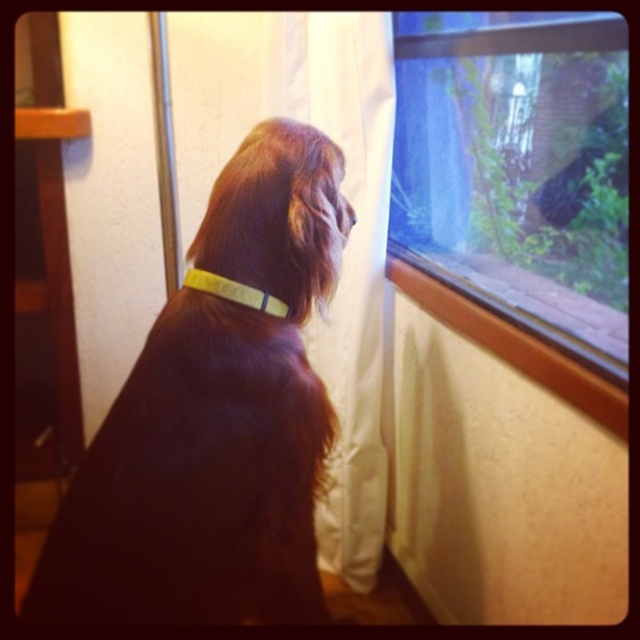
Question: Estimate the real-world distances between objects in this image. Which object is closer to the brown fur dog at center?

Choices:
 (A) transparent glass window at upper right
 (B) brown fur nose at upper center
 (C) yellow fabric neckband at center
 (D) white fabric curtain at center

Answer: (C)

Question: Does brown fur dog at center have a smaller size compared to brown fur nose at upper center?

Choices:
 (A) yes
 (B) no

Answer: (B)

Question: Is brown fur dog at center to the right of transparent glass window at upper right from the viewer's perspective?

Choices:
 (A) yes
 (B) no

Answer: (B)

Question: Does transparent glass window at upper right have a greater width compared to yellow fabric neckband at center?

Choices:
 (A) no
 (B) yes

Answer: (B)

Question: Based on their relative distances, which object is farther from the transparent glass window at upper right?

Choices:
 (A) brown fur nose at upper center
 (B) yellow fabric neckband at center
 (C) white fabric curtain at center

Answer: (B)

Question: Which point is farther to the camera?

Choices:
 (A) (234, 298)
 (B) (333, 486)
 (C) (552, 269)
 (D) (285, 412)

Answer: (B)